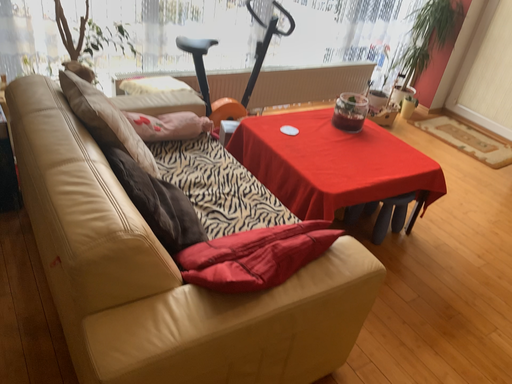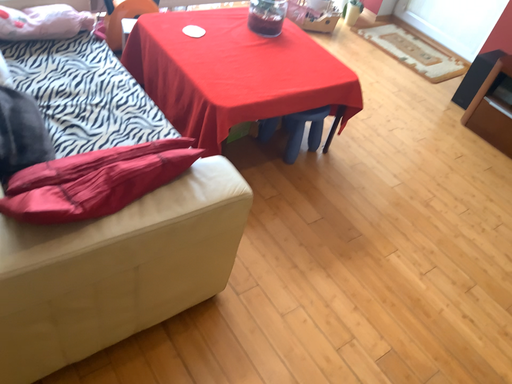
Question: Which way did the camera rotate in the video?

Choices:
 (A) rotated upward
 (B) rotated downward

Answer: (B)